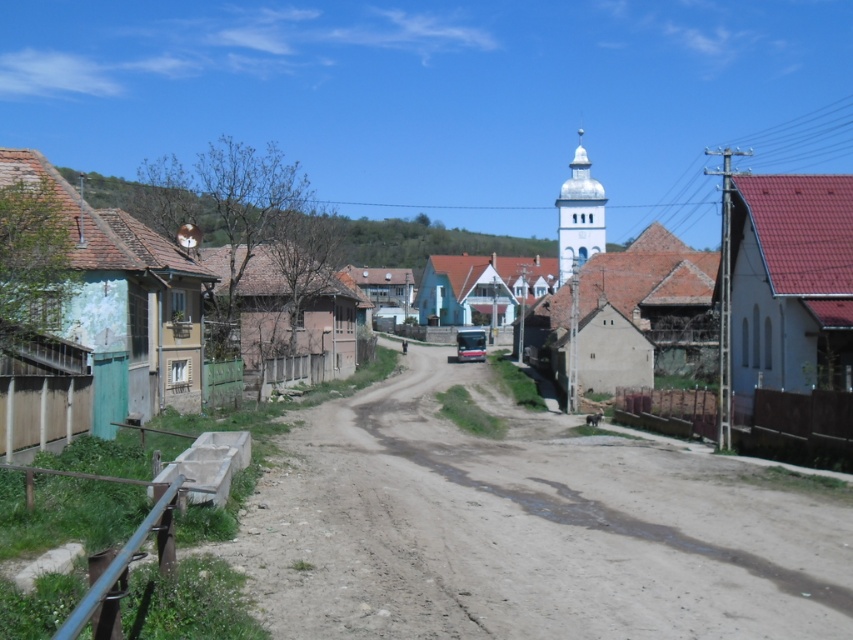
Is brown dirt track at center to the left of metallic silver car at center from the viewer's perspective?

Correct, you'll find brown dirt track at center to the left of metallic silver car at center.

Between point (769, 612) and point (479, 353), which one is positioned behind?

The point (479, 353) is behind.

Where is `brown dirt track at center`? Image resolution: width=853 pixels, height=640 pixels. brown dirt track at center is located at coordinates (526, 529).

At what (x,y) coordinates should I click in order to perform the action: click on brown dirt track at center. Please return your answer as a coordinate pair (x, y). This screenshot has height=640, width=853. Looking at the image, I should click on (526, 529).

Is brown dirt track at center shorter than matte concrete road at center?

Yes, brown dirt track at center is shorter than matte concrete road at center.

Between brown dirt track at center and matte concrete road at center, which one appears on the right side from the viewer's perspective?

matte concrete road at center

Find the location of a particular element. The height and width of the screenshot is (640, 853). brown dirt track at center is located at coordinates (526, 529).

Does matte concrete road at center have a lesser height compared to white stucco church at center?

Correct, matte concrete road at center is not as tall as white stucco church at center.

How far apart are matte concrete road at center and white stucco church at center?

matte concrete road at center is 94.16 feet from white stucco church at center.

The width and height of the screenshot is (853, 640). Describe the element at coordinates (654, 276) in the screenshot. I see `matte concrete road at center` at that location.

Find the location of a particular element. This screenshot has height=640, width=853. matte concrete road at center is located at coordinates (654, 276).